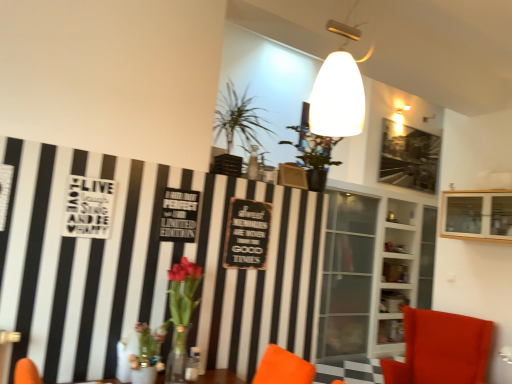
Where is `wooden cabinet at upper right, the 1th shelf from the front`? The width and height of the screenshot is (512, 384). wooden cabinet at upper right, the 1th shelf from the front is located at coordinates (476, 215).

What is the approximate width of wooden signboard at center?

wooden signboard at center is 1.10 inches in width.

What do you see at coordinates (441, 349) in the screenshot?
I see `velvet orange chair at lower right` at bounding box center [441, 349].

Identify the location of green leafy plant at upper center. The width and height of the screenshot is (512, 384). (238, 118).

Is translucent glass vase at lower left facing towards wooden cabinet at upper right, which ranks as the 2th shelf in back-to-front order?

No.

Considering the relative sizes of translucent glass vase at lower left and wooden cabinet at upper right, which ranks as the 2th shelf in back-to-front order, in the image provided, is translucent glass vase at lower left wider than wooden cabinet at upper right, which ranks as the 2th shelf in back-to-front order,?

Incorrect, the width of translucent glass vase at lower left does not surpass that of wooden cabinet at upper right, which ranks as the 2th shelf in back-to-front order.

From the image's perspective, is translucent glass vase at lower left on top of wooden cabinet at upper right, which ranks as the 2th shelf in back-to-front order?

No, from the image's perspective, translucent glass vase at lower left is not on top of wooden cabinet at upper right, which ranks as the 2th shelf in back-to-front order.

Where is `houseplant on the left side of velvet orange chair at lower right`? houseplant on the left side of velvet orange chair at lower right is located at coordinates (238, 118).

Which object is further away from the camera taking this photo, green leafy plant at upper center or velvet orange chair at lower right?

velvet orange chair at lower right is further from the camera.

Between point (243, 109) and point (433, 363), which one is positioned behind?

The point (433, 363) is farther from the camera.

Is wooden cabinet at upper right, which ranks as the 2th shelf in back-to-front order, bigger or smaller than wooden signboard at center?

In the image, wooden cabinet at upper right, which ranks as the 2th shelf in back-to-front order, appears to be larger than wooden signboard at center.

From the picture: Is wooden cabinet at upper right, the 1th shelf from the front, outside of wooden signboard at center?

wooden cabinet at upper right, the 1th shelf from the front, lies outside wooden signboard at center's area.

Is wooden cabinet at upper right, the 1th shelf from the front, turned away from wooden signboard at center?

No.

Which object is wider, wooden cabinet at upper right, the 1th shelf from the front, or wooden signboard at center?

Wider between the two is wooden cabinet at upper right, the 1th shelf from the front.

Between white glass shelves at center, which is the first shelf from back to front, and wooden signboard at center, which one appears on the left side from the viewer's perspective?

wooden signboard at center is more to the left.

Is wooden signboard at center inside white glass shelves at center, the 2th shelf when ordered from front to back?

No, wooden signboard at center is located outside of white glass shelves at center, the 2th shelf when ordered from front to back.

Where is `the 1st shelf to the right when counting from the green leafy plant at upper center`? the 1st shelf to the right when counting from the green leafy plant at upper center is located at coordinates (397, 272).

Between white glass shelves at center, the 2th shelf when ordered from front to back, and green leafy plant at upper center, which one is positioned behind?

white glass shelves at center, the 2th shelf when ordered from front to back, is further from the camera.

In terms of size, does white glass shelves at center, which is the first shelf from back to front, appear bigger or smaller than green leafy plant at upper center?

Clearly, white glass shelves at center, which is the first shelf from back to front, is larger in size than green leafy plant at upper center.

Is white glass shelves at center, the 2th shelf when ordered from front to back, turned away from green leafy plant at upper center?

white glass shelves at center, the 2th shelf when ordered from front to back, is not turned away from green leafy plant at upper center.

Between velvet orange chair at lower right and translucent glass vase at lower left, which one has more height?

Standing taller between the two is velvet orange chair at lower right.

Looking at this image, which is more to the right, velvet orange chair at lower right or translucent glass vase at lower left?

Positioned to the right is velvet orange chair at lower right.

Which object is thinner, velvet orange chair at lower right or translucent glass vase at lower left?

With smaller width is translucent glass vase at lower left.

Between white glass shelves at center, which is the first shelf from back to front, and wooden cabinet at upper right, the 1th shelf from the front, which one is positioned behind?

Positioned behind is white glass shelves at center, which is the first shelf from back to front.

Is white glass shelves at center, the 2th shelf when ordered from front to back, not near wooden cabinet at upper right, the 1th shelf from the front?

No, white glass shelves at center, the 2th shelf when ordered from front to back, is not far away from wooden cabinet at upper right, the 1th shelf from the front.

Is point (403, 294) less distant than point (443, 191)?

Yes.

This screenshot has width=512, height=384. Identify the location of floral arrangement on the left of wooden cabinet at upper right, the 1th shelf from the front. (166, 328).

In order to click on houseplant above the velvet orange chair at lower right (from the image's perspective) in this screenshot , I will do `click(238, 118)`.

Considering their positions, is velvet orange chair at lower right positioned further to wooden cabinet at upper right, the 1th shelf from the front, than white glass shelves at center, which is the first shelf from back to front?

velvet orange chair at lower right is positioned further to the anchor wooden cabinet at upper right, the 1th shelf from the front.

When comparing their distances from green leafy plant at upper center, does wooden signboard at center or velvet orange chair at lower right seem further?

The object further to green leafy plant at upper center is velvet orange chair at lower right.

Considering their positions, is translucent glass vase at lower left positioned closer to velvet orange chair at lower right than wooden cabinet at upper right, which ranks as the 2th shelf in back-to-front order?

Based on the image, wooden cabinet at upper right, which ranks as the 2th shelf in back-to-front order, appears to be nearer to velvet orange chair at lower right.

Based on their spatial positions, is translucent glass vase at lower left or wooden cabinet at upper right, which ranks as the 2th shelf in back-to-front order, further from wooden signboard at center?

wooden cabinet at upper right, which ranks as the 2th shelf in back-to-front order, is further to wooden signboard at center.

Considering their positions, is wooden cabinet at upper right, which ranks as the 2th shelf in back-to-front order, positioned further to translucent glass vase at lower left than velvet orange chair at lower right?

wooden cabinet at upper right, which ranks as the 2th shelf in back-to-front order.

When comparing their distances from wooden signboard at center, does translucent glass vase at lower left or white glass shelves at center, which is the first shelf from back to front, seem closer?

translucent glass vase at lower left lies closer to wooden signboard at center than the other object.

Looking at the image, which one is located closer to white glass shelves at center, which is the first shelf from back to front, wooden signboard at center or wooden cabinet at upper right, which ranks as the 2th shelf in back-to-front order?

Based on the image, wooden cabinet at upper right, which ranks as the 2th shelf in back-to-front order, appears to be nearer to white glass shelves at center, which is the first shelf from back to front.

Based on the photo, looking at the image, which one is located closer to green leafy plant at upper center, white glass shelves at center, the 2th shelf when ordered from front to back, or wooden signboard at center?

wooden signboard at center is positioned closer to the anchor green leafy plant at upper center.

Identify the location of chair located between wooden signboard at center and wooden cabinet at upper right, the 1th shelf from the front, in the left-right direction. (441, 349).

The image size is (512, 384). Identify the location of shelf located between wooden signboard at center and white glass shelves at center, which is the first shelf from back to front, in the depth direction. (476, 215).

The image size is (512, 384). I want to click on houseplant between translucent glass vase at lower left and white glass shelves at center, the 2th shelf when ordered from front to back, along the z-axis, so click(238, 118).

At what (x,y) coordinates should I click in order to perform the action: click on writing that lies between green leafy plant at upper center and translucent glass vase at lower left from top to bottom. Please return your answer as a coordinate pair (x, y). The width and height of the screenshot is (512, 384). Looking at the image, I should click on (247, 234).